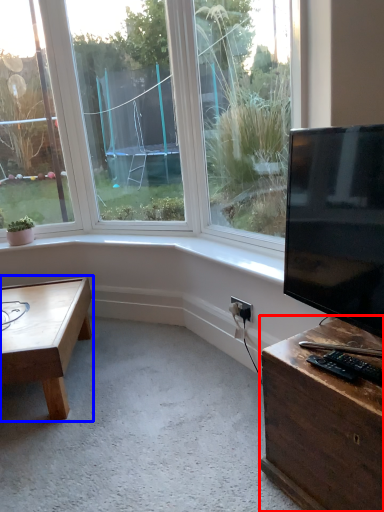
Question: Among these objects, which one is nearest to the camera, desk (highlighted by a red box) or coffee table (highlighted by a blue box)?

Choices:
 (A) desk
 (B) coffee table

Answer: (A)